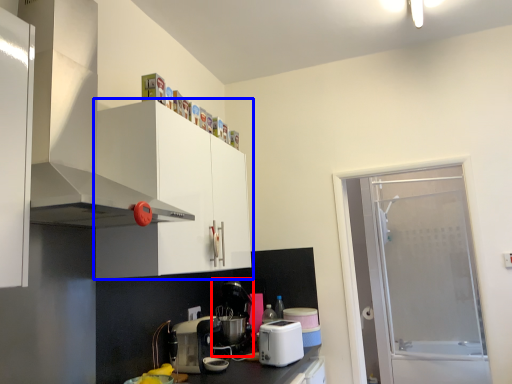
Question: Which point is closer to the camera, coffee machine (highlighted by a red box) or cabinetry (highlighted by a blue box)?

Choices:
 (A) coffee machine
 (B) cabinetry

Answer: (B)